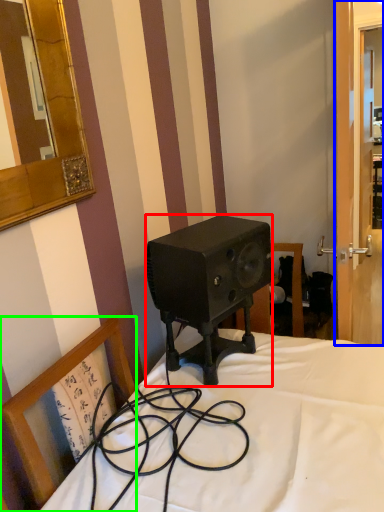
Question: Estimate the real-world distances between objects in this image. Which object is closer to speaker (highlighted by a red box), screen door (highlighted by a blue box) or chair (highlighted by a green box)?

Choices:
 (A) screen door
 (B) chair

Answer: (B)